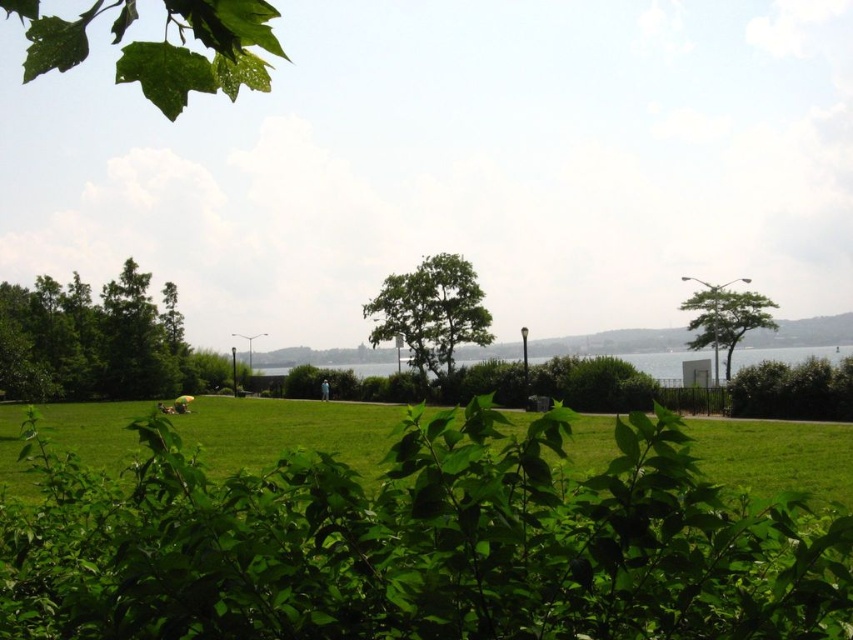
You are a gardener who wants to plant a new tree that requires at least 3 meters of height clearance. Based on the scene, which object between the green leafy bush at center and the green leafy tree at left would be the better option to consider for planting the new tree near?

The green leafy tree at left is taller than the green leafy bush at center, so planting the new tree near the green leafy tree at left would provide the necessary height clearance required.

You are an artist sketching the park scene and want to place the green glossy leaf at upper left accurately. According to the coordinates provided, where should you position it on your canvas?

The green glossy leaf at upper left should be positioned at the coordinates point (202, 54) on the canvas.

You are standing in the park and want to take a photo that includes both the point at coordinates point [460,321] and point [834,397]. Which point should you focus on to ensure both are in focus?

You should focus on point [460,321] because it is closer to you than point [834,397], ensuring both are within the depth of field.